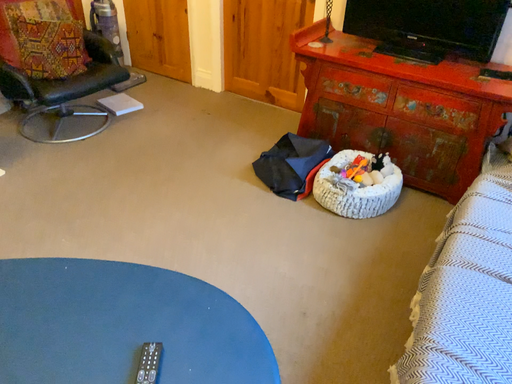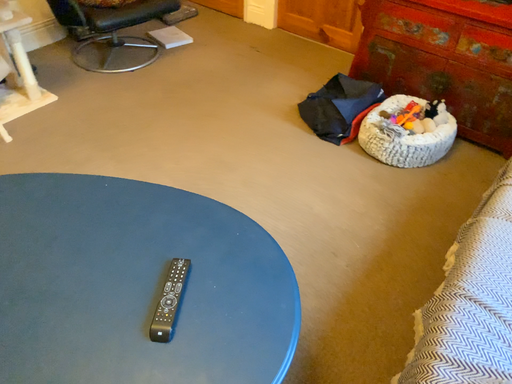
Question: Which way did the camera rotate in the video?

Choices:
 (A) rotated left
 (B) rotated right

Answer: (A)